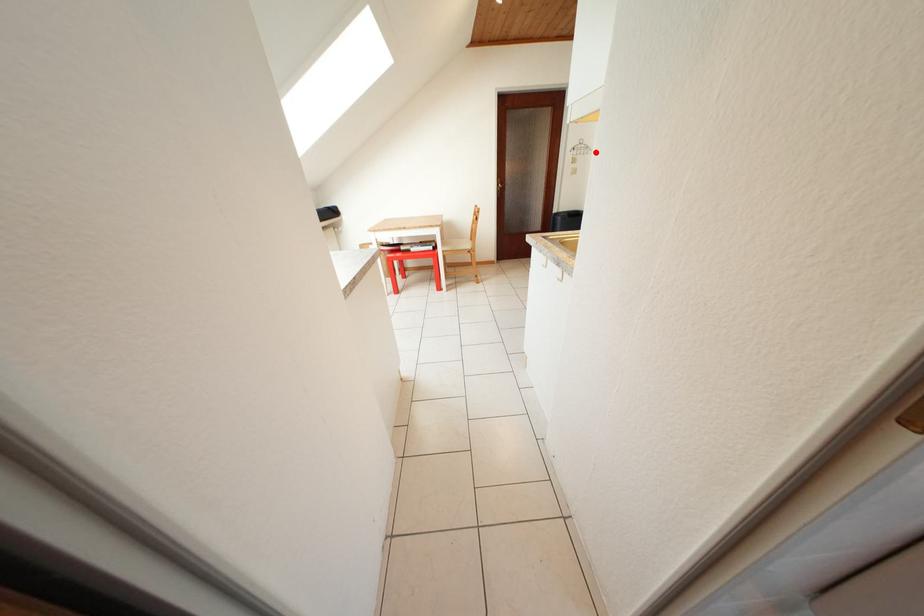
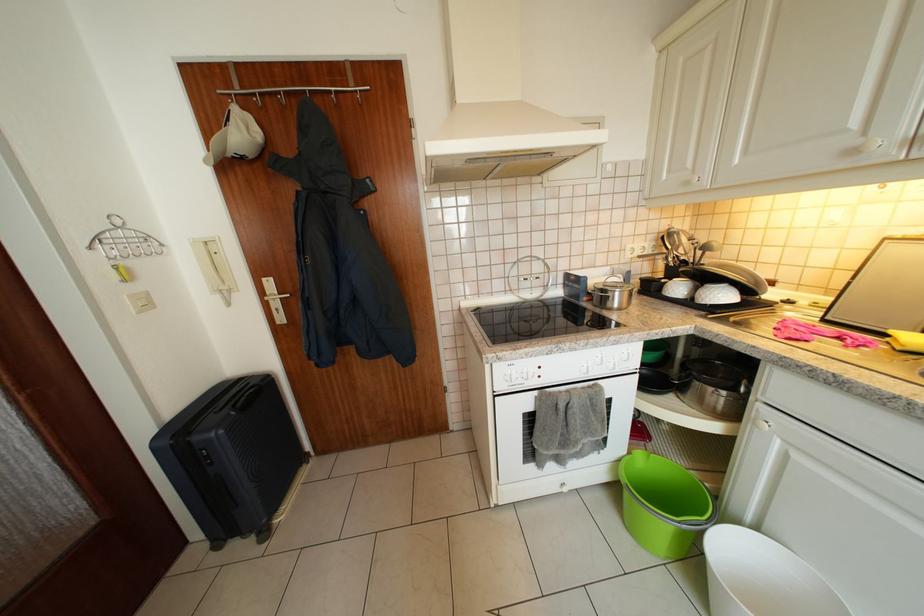
The point at the highlighted location is marked in the first image. Where is the corresponding point in the second image?

(156, 243)